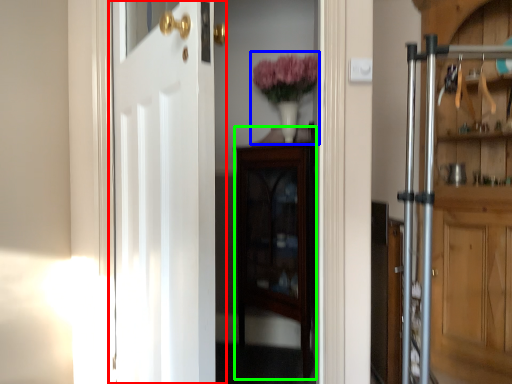
Question: Estimate the real-world distances between objects in this image. Which object is farther from door (highlighted by a red box), floral arrangement (highlighted by a blue box) or cabinetry (highlighted by a green box)?

Choices:
 (A) floral arrangement
 (B) cabinetry

Answer: (A)